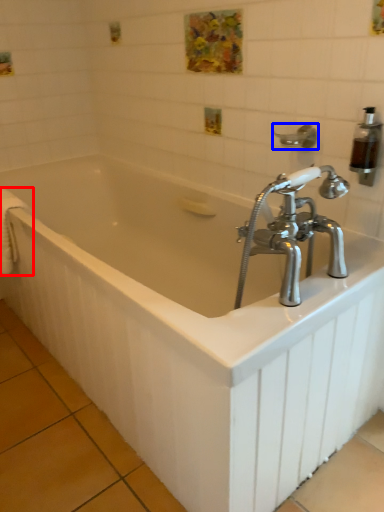
Question: Which object is further to the camera taking this photo, towel bar (highlighted by a red box) or shower (highlighted by a blue box)?

Choices:
 (A) towel bar
 (B) shower

Answer: (A)